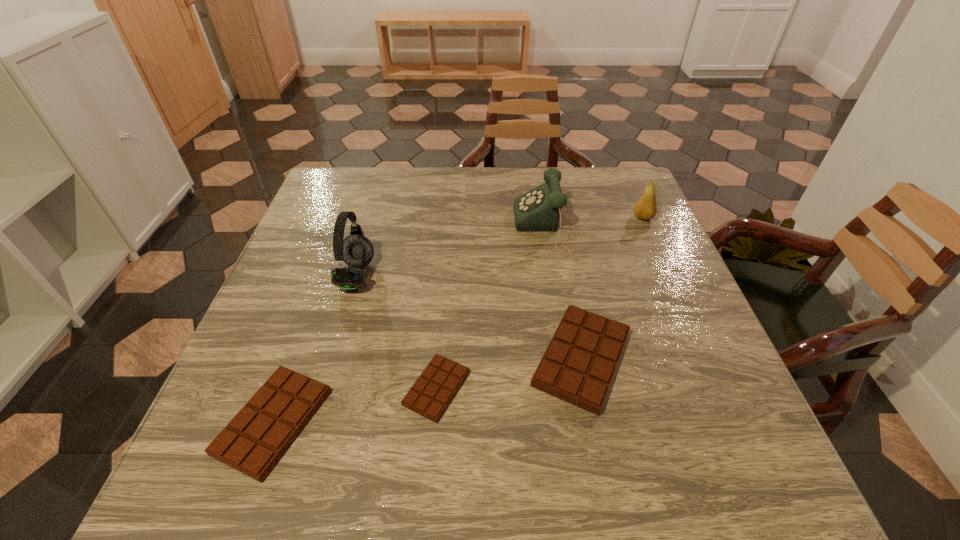
Identify the location of object located at the right edge. The width and height of the screenshot is (960, 540). (645, 208).

This screenshot has height=540, width=960. What are the coordinates of `object positioned at the near left corner` in the screenshot? It's located at (253, 442).

The image size is (960, 540). I want to click on object situated at the far right corner, so click(645, 208).

Identify the location of free region at the far edge of the desktop. (406, 186).

Locate an element on the screen. blank space at the near edge of the desktop is located at coordinates (461, 406).

In the image, there is a desktop. At what (x,y) coordinates should I click in order to perform the action: click on free region at the left edge. Please return your answer as a coordinate pair (x, y). This screenshot has height=540, width=960. Looking at the image, I should click on (335, 221).

In the image, there is a desktop. Identify the location of vacant space at the right edge. This screenshot has width=960, height=540. (665, 258).

Where is `free spot at the far right corner of the desktop`? The image size is (960, 540). free spot at the far right corner of the desktop is located at coordinates (606, 170).

Where is `empty space between the telephone and the second tallest candy bar`? empty space between the telephone and the second tallest candy bar is located at coordinates (410, 325).

Where is `free spot between the telephone and the rightmost candy bar`? This screenshot has height=540, width=960. free spot between the telephone and the rightmost candy bar is located at coordinates (564, 293).